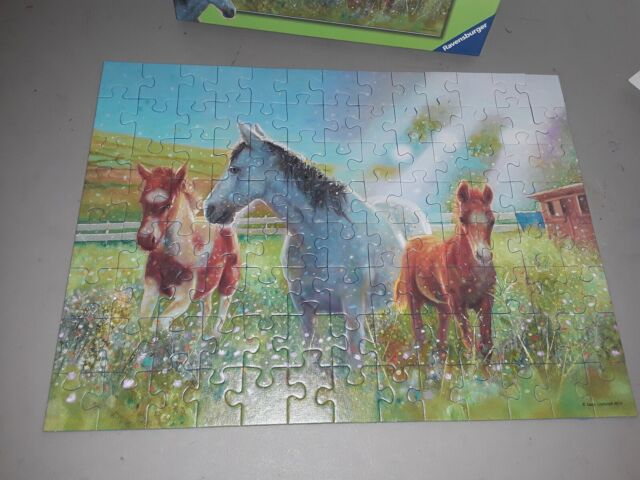
Where is `table`? The image size is (640, 480). table is located at coordinates (434, 469).